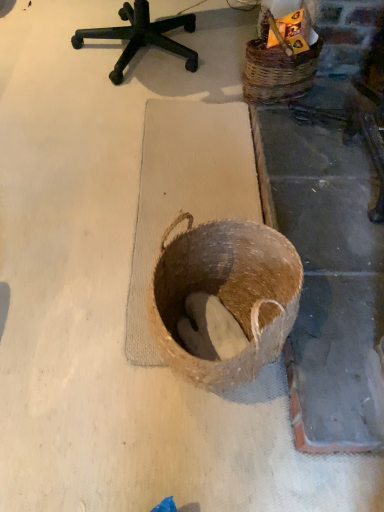
Question: Is wooden crate at upper right positioned with its back to woven brown basket at upper right, which ranks as the second basket in left-to-right order?

Choices:
 (A) no
 (B) yes

Answer: (B)

Question: From the image's perspective, would you say wooden crate at upper right is positioned over woven brown basket at upper right, positioned as the 1th basket in top-to-bottom order?

Choices:
 (A) no
 (B) yes

Answer: (B)

Question: From the image's perspective, is wooden crate at upper right beneath woven brown basket at upper right, the second basket when ordered from bottom to top?

Choices:
 (A) no
 (B) yes

Answer: (A)

Question: Is wooden crate at upper right positioned behind woven brown basket at upper right, which ranks as the first basket in back-to-front order?

Choices:
 (A) yes
 (B) no

Answer: (A)

Question: Can you confirm if wooden crate at upper right is bigger than woven brown basket at upper right, which ranks as the second basket in left-to-right order?

Choices:
 (A) no
 (B) yes

Answer: (A)

Question: Are wooden crate at upper right and woven brown basket at upper right, positioned as the 1th basket in top-to-bottom order, located far from each other?

Choices:
 (A) no
 (B) yes

Answer: (A)

Question: Does brown woven basket at center, which ranks as the 1th basket in bottom-to-top order, have a larger size compared to woven brown basket at upper right, the second basket when ordered from bottom to top?

Choices:
 (A) no
 (B) yes

Answer: (B)

Question: From the image's perspective, is brown woven basket at center, positioned as the first basket in left-to-right order, beneath woven brown basket at upper right, which ranks as the first basket in right-to-left order?

Choices:
 (A) yes
 (B) no

Answer: (A)

Question: From a real-world perspective, is brown woven basket at center, the 2th basket from the back, under woven brown basket at upper right, positioned as the 1th basket in top-to-bottom order?

Choices:
 (A) yes
 (B) no

Answer: (A)

Question: From the image's perspective, is brown woven basket at center, positioned as the first basket in left-to-right order, above woven brown basket at upper right, which ranks as the second basket in left-to-right order?

Choices:
 (A) yes
 (B) no

Answer: (B)

Question: Does brown woven basket at center, which is counted as the second basket, starting from the right, turn towards woven brown basket at upper right, which ranks as the second basket in left-to-right order?

Choices:
 (A) no
 (B) yes

Answer: (A)

Question: Is woven brown basket at upper right, which ranks as the first basket in right-to-left order, completely or partially inside brown woven basket at center, which ranks as the 1th basket in bottom-to-top order?

Choices:
 (A) no
 (B) yes

Answer: (A)

Question: Is woven brown basket at upper right, which is the second basket from front to back, not close to wooden crate at upper right?

Choices:
 (A) no
 (B) yes

Answer: (A)